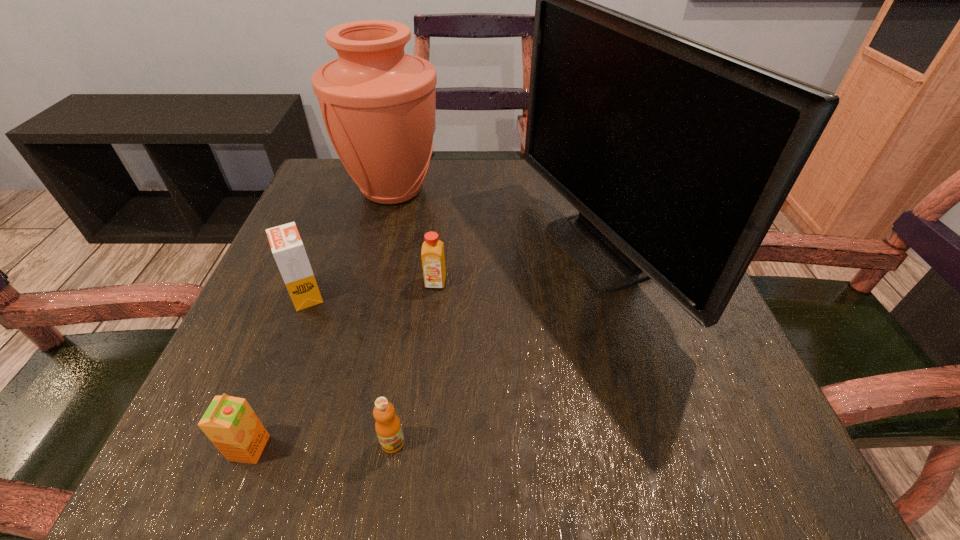
Identify which object is the third closest to the third orange juice from left to right. Please provide its 2D coordinates. Your answer should be formatted as a tuple, i.e. [(x, y)], where the tuple contains the x and y coordinates of a point satisfying the conditions above.

[(287, 247)]

Find the location of `object that stands as the fifth closest to the tallest orange juice`. object that stands as the fifth closest to the tallest orange juice is located at coordinates (678, 156).

The image size is (960, 540). In order to click on orange juice that is the closest to the rightmost orange juice in this screenshot , I will do click(x=287, y=247).

At what (x,y) coordinates should I click in order to perform the action: click on orange juice object that ranks as the fourth closest to the tallest object. Please return your answer as a coordinate pair (x, y). The width and height of the screenshot is (960, 540). Looking at the image, I should click on (229, 422).

The image size is (960, 540). I want to click on free spot that satisfies the following two spatial constraints: 1. on the front-facing side of the rightmost object; 2. on the front label of the third orange juice from left to right, so click(x=648, y=442).

Locate an element on the screen. This screenshot has height=540, width=960. vacant position in the image that satisfies the following two spatial constraints: 1. on the front-facing side of the computer monitor; 2. on the front and back of the rightmost orange juice is located at coordinates (603, 282).